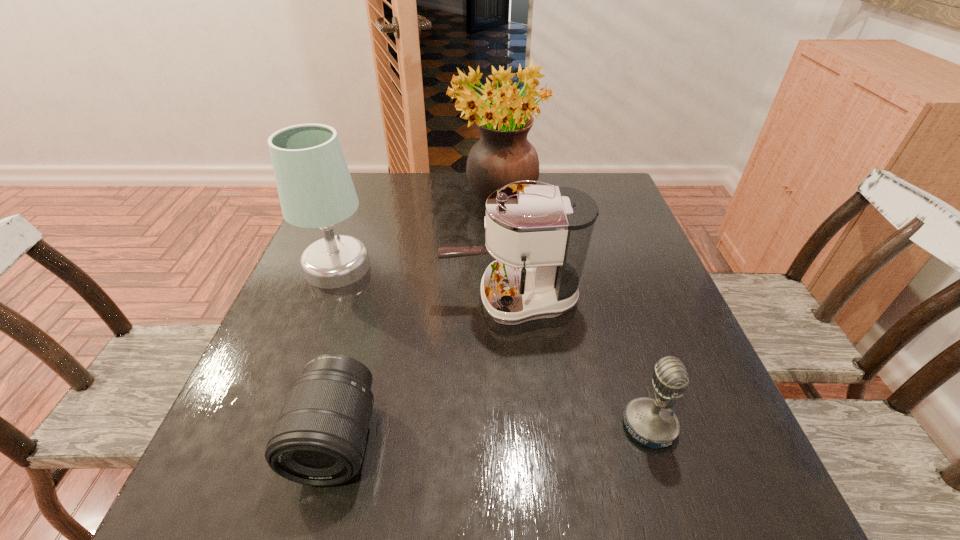
The width and height of the screenshot is (960, 540). Identify the location of free area in between the telephoto lens and the second shortest object. (492, 432).

Identify the location of blank region between the lampshade and the coffee maker. (424, 283).

Identify the location of vacant area that lies between the microphone and the farthest object. (573, 315).

This screenshot has width=960, height=540. I want to click on vacant space that's between the rightmost object and the lampshade, so coord(493,347).

What are the coordinates of `empty space between the telephoto lens and the lampshade` in the screenshot? It's located at (337, 353).

Select which object appears as the fourth closest to the lampshade. Please provide its 2D coordinates. Your answer should be formatted as a tuple, i.e. [(x, y)], where the tuple contains the x and y coordinates of a point satisfying the conditions above.

[(652, 423)]

Locate an element on the screen. This screenshot has height=540, width=960. object that can be found as the second closest to the second shortest object is located at coordinates pos(319,439).

Where is `vacant area in the image that satisfies the following two spatial constraints: 1. on the front-facing side of the rightmost object; 2. on the surface of the shortest object`? The image size is (960, 540). vacant area in the image that satisfies the following two spatial constraints: 1. on the front-facing side of the rightmost object; 2. on the surface of the shortest object is located at coordinates (653, 438).